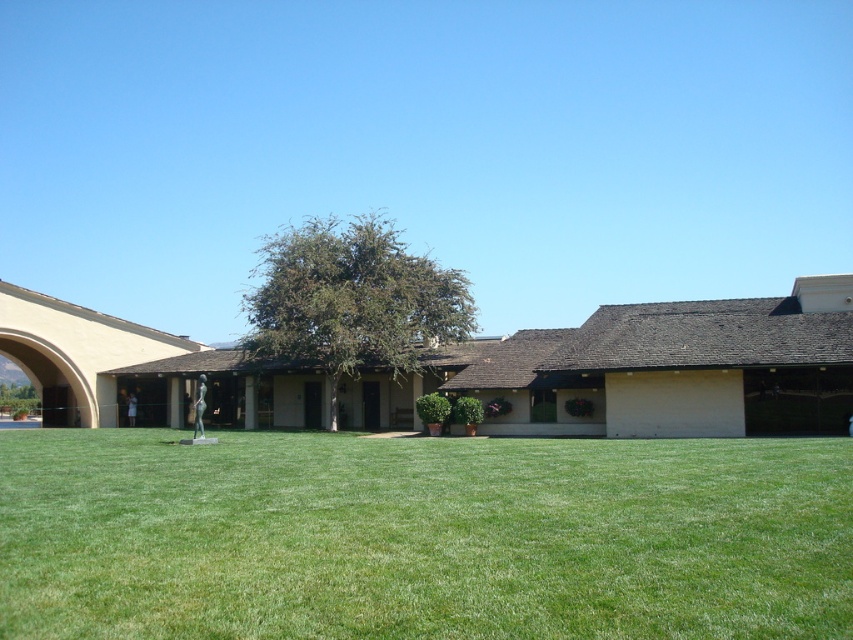
Question: Among these objects, which one is farthest from the camera?

Choices:
 (A) green grass at center
 (B) green leafy tree at center

Answer: (B)

Question: Does green grass at center appear on the right side of green leafy tree at center?

Choices:
 (A) no
 (B) yes

Answer: (B)

Question: Is green grass at center above green leafy tree at center?

Choices:
 (A) no
 (B) yes

Answer: (A)

Question: Can you confirm if green grass at center is positioned to the left of green leafy tree at center?

Choices:
 (A) no
 (B) yes

Answer: (A)